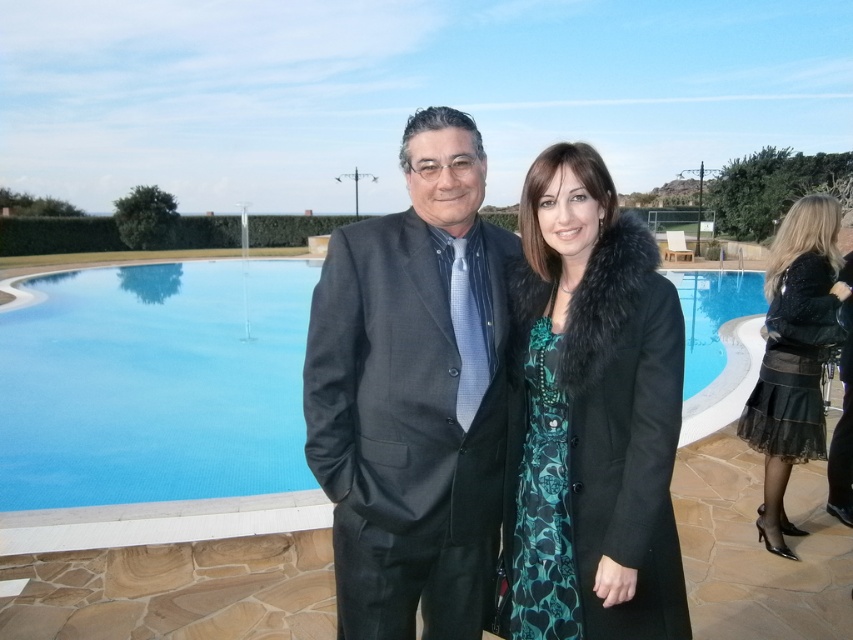
You are a photographer trying to capture the matte black suit at center. Based on the coordinates provided in the Objects Description, can you determine if the suit is positioned closer to the edge of the pool or near the center of the pool?

The matte black suit at center is located at point coordinates, so it is positioned near the center of the pool.